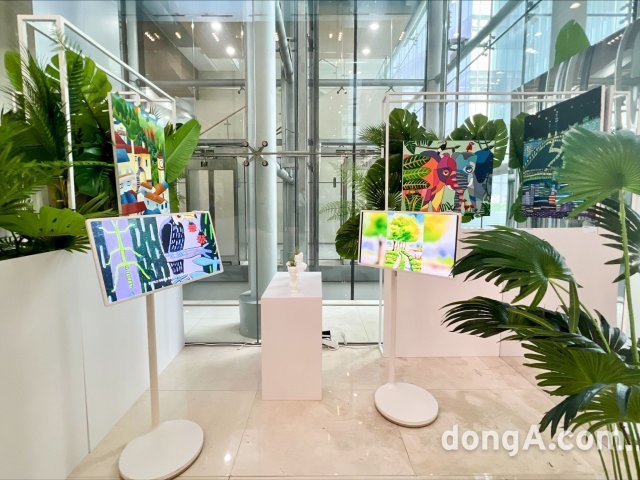
I want to click on monitor stands, so 155,385, 393,340.